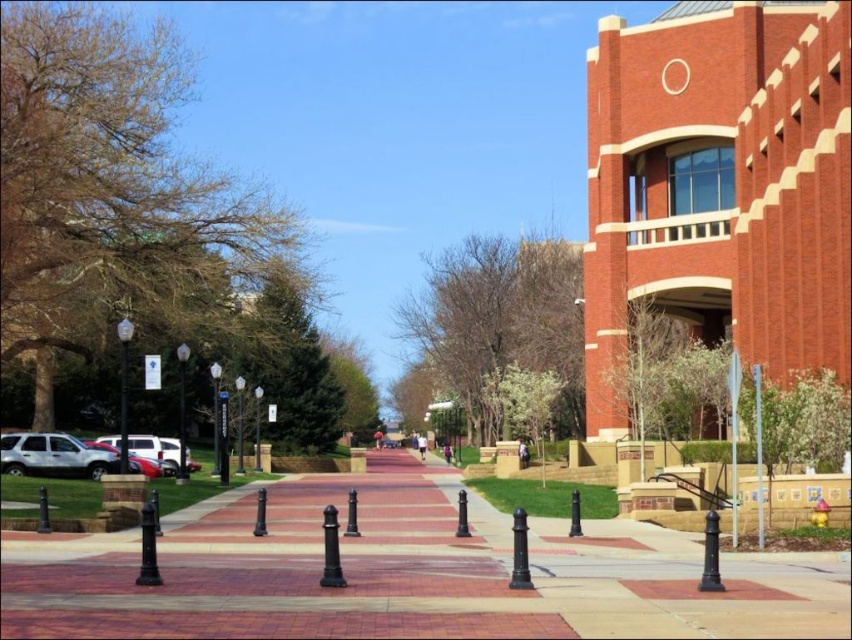
Question: Estimate the real-world distances between objects in this image. Which object is farther from the brown leafy tree at center?

Choices:
 (A) brick pavement at center
 (B) silver metallic suv at left

Answer: (B)

Question: Can you confirm if brick pavement at center is smaller than metallic silver pole at right?

Choices:
 (A) no
 (B) yes

Answer: (A)

Question: Which point is closer to the camera taking this photo?

Choices:
 (A) (181, 428)
 (B) (347, 404)

Answer: (A)

Question: Is brown leafy tree at left positioned in front of metallic streetlight at center-left?

Choices:
 (A) no
 (B) yes

Answer: (A)

Question: Which object is positioned closest to the green leafy tree at center?

Choices:
 (A) silver metallic suv at left
 (B) metallic silver suv at left
 (C) metallic silver pole at right

Answer: (B)

Question: Can you confirm if brick pavement at center is bigger than metallic silver pole at right?

Choices:
 (A) yes
 (B) no

Answer: (A)